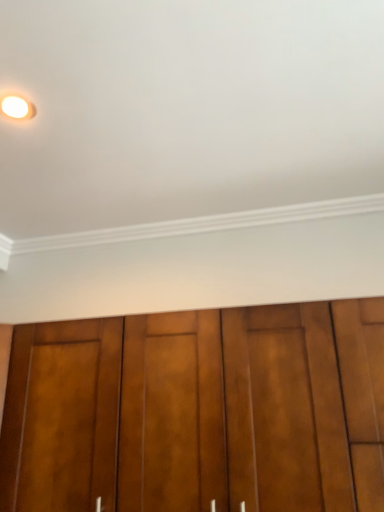
Question: Considering the positions of point (251, 497) and point (36, 112), is point (251, 497) closer or farther from the camera than point (36, 112)?

Choices:
 (A) farther
 (B) closer

Answer: (B)

Question: In the image, is brown wood door at lower center positioned in front of or behind matte white light fixture at upper left?

Choices:
 (A) front
 (B) behind

Answer: (A)

Question: From the image's perspective, relative to matte white light fixture at upper left, is brown wood door at lower center above or below?

Choices:
 (A) above
 (B) below

Answer: (B)

Question: Considering the positions of matte white light fixture at upper left and brown wood door at lower center in the image, is matte white light fixture at upper left bigger or smaller than brown wood door at lower center?

Choices:
 (A) big
 (B) small

Answer: (B)

Question: Considering their positions, is matte white light fixture at upper left located in front of or behind brown wood door at lower center?

Choices:
 (A) behind
 (B) front

Answer: (A)

Question: Does point [x=1, y=99] appear closer or farther from the camera than point [x=157, y=349]?

Choices:
 (A) closer
 (B) farther

Answer: (A)

Question: Is matte white light fixture at upper left wider or thinner than brown wood door at lower center?

Choices:
 (A) thin
 (B) wide

Answer: (A)